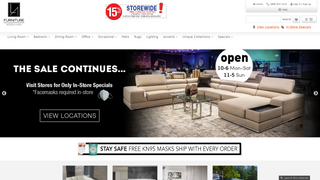
In order to click on table in this screenshot , I will do pyautogui.click(x=203, y=97).